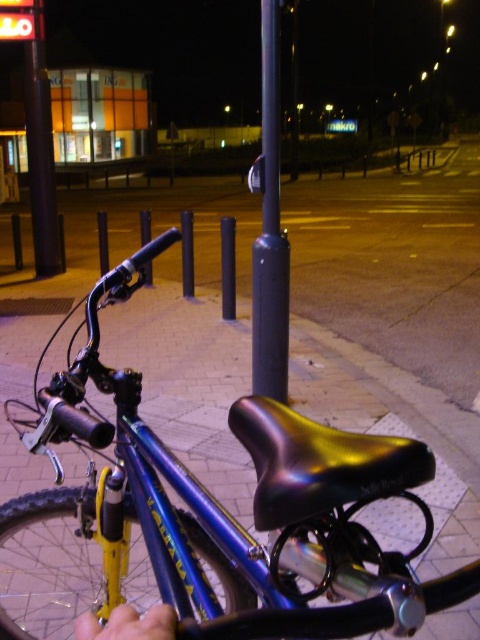
Question: Considering the real-world distances, which object is farthest from the black matte pole at center?

Choices:
 (A) blue metallic bicycle at center
 (B) smooth black pole at upper left

Answer: (B)

Question: Which point appears farthest from the camera in this image?

Choices:
 (A) (260, 237)
 (B) (239, 525)

Answer: (A)

Question: Among these points, which one is nearest to the camera?

Choices:
 (A) (35, 243)
 (B) (276, 381)

Answer: (B)

Question: Does blue metallic bicycle at center appear on the left side of smooth black pole at upper left?

Choices:
 (A) no
 (B) yes

Answer: (A)

Question: Does blue metallic bicycle at center appear over smooth black pole at upper left?

Choices:
 (A) no
 (B) yes

Answer: (A)

Question: Can you confirm if blue metallic bicycle at center is bigger than black matte pole at center?

Choices:
 (A) no
 (B) yes

Answer: (B)